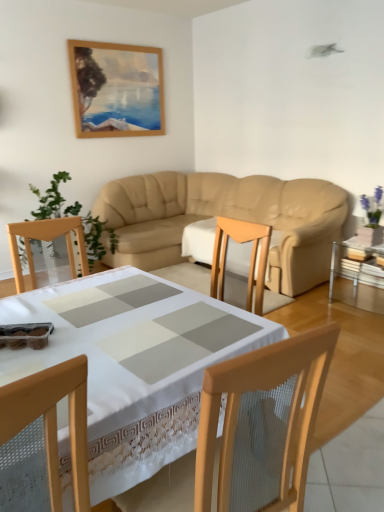
This screenshot has width=384, height=512. Describe the element at coordinates (50, 198) in the screenshot. I see `green leafy plant at left` at that location.

This screenshot has width=384, height=512. What do you see at coordinates (46, 434) in the screenshot?
I see `wooden chair at lower left` at bounding box center [46, 434].

Consider the image. Measure the distance between white lace tablecloth at center, which is the 2th table in back-to-front order, and camera.

The distance of white lace tablecloth at center, which is the 2th table in back-to-front order, from camera is 33.50 inches.

The width and height of the screenshot is (384, 512). I want to click on beige leather couch at center, so click(225, 216).

Which is more to the left, green leafy plant at left or clear glass table at right, placed as the first table when sorted from right to left?

green leafy plant at left.

Is green leafy plant at left situated inside clear glass table at right, placed as the first table when sorted from right to left, or outside?

green leafy plant at left is located beyond the bounds of clear glass table at right, placed as the first table when sorted from right to left.

Are green leafy plant at left and clear glass table at right, which ranks as the second table in front-to-back order, far apart?

Absolutely, green leafy plant at left is distant from clear glass table at right, which ranks as the second table in front-to-back order.

Measure the distance from green leafy plant at left to clear glass table at right, arranged as the 2th table when viewed from the left.

green leafy plant at left and clear glass table at right, arranged as the 2th table when viewed from the left, are 2.50 meters apart from each other.

From a real-world perspective, between white lace tablecloth at center, arranged as the first table when viewed from the front, and beige leather couch at center, who is vertically lower?

In real-world perspective, white lace tablecloth at center, arranged as the first table when viewed from the front, is lower.

Would you say white lace tablecloth at center, which is the 2th table in back-to-front order, is to the left or to the right of beige leather couch at center in the picture?

white lace tablecloth at center, which is the 2th table in back-to-front order, is positioned on beige leather couch at center's left side.

Between point (137, 315) and point (105, 200), which one is positioned in front?

Positioned in front is point (137, 315).

Looking at this image, does clear glass table at right, placed as the first table when sorted from right to left, turn towards white lace tablecloth at center, which is the 2th table in back-to-front order?

Yes, clear glass table at right, placed as the first table when sorted from right to left, is aimed at white lace tablecloth at center, which is the 2th table in back-to-front order.

Is there a large distance between clear glass table at right, placed as the first table when sorted from right to left, and white lace tablecloth at center, which is the 2th table in back-to-front order?

That's right, there is a large distance between clear glass table at right, placed as the first table when sorted from right to left, and white lace tablecloth at center, which is the 2th table in back-to-front order.

From the image's perspective, between clear glass table at right, placed as the first table when sorted from right to left, and white lace tablecloth at center, the 2th table positioned from the right, which one is located above?

clear glass table at right, placed as the first table when sorted from right to left, is shown above in the image.

Looking at this image, considering the relative sizes of clear glass table at right, placed as the first table when sorted from right to left, and white lace tablecloth at center, the 2th table positioned from the right, in the image provided, is clear glass table at right, placed as the first table when sorted from right to left, taller than white lace tablecloth at center, the 2th table positioned from the right,?

No.

From a real-world perspective, is clear glass table at right, which is the first table in back-to-front order, on top of wooden chair at lower left?

No.

From the image's perspective, which one is positioned higher, clear glass table at right, which ranks as the second table in front-to-back order, or wooden chair at lower left?

clear glass table at right, which ranks as the second table in front-to-back order.

Considering their positions, is clear glass table at right, placed as the first table when sorted from right to left, located in front of or behind wooden chair at lower left?

In the image, clear glass table at right, placed as the first table when sorted from right to left, appears behind wooden chair at lower left.

Is beige leather couch at center to the left or to the right of wooden chair at lower left in the image?

Clearly, beige leather couch at center is on the right of wooden chair at lower left in the image.

Considering the sizes of objects beige leather couch at center and wooden chair at lower left in the image provided, who is bigger, beige leather couch at center or wooden chair at lower left?

beige leather couch at center is bigger.

From the picture: Can you tell me how much beige leather couch at center and wooden chair at lower left differ in facing direction?

86.3 degrees.

Is beige leather couch at center turned away from wooden chair at lower left?

No, beige leather couch at center is not facing the opposite direction of wooden chair at lower left.

From the image's perspective, is white lace tablecloth at center, arranged as the first table when viewed from the front, on top of green leafy plant at left?

No, from the image's perspective, white lace tablecloth at center, arranged as the first table when viewed from the front, is not over green leafy plant at left.

Are white lace tablecloth at center, the 2th table positioned from the right, and green leafy plant at left beside each other?

No, white lace tablecloth at center, the 2th table positioned from the right, is not with green leafy plant at left.

Which of these two, white lace tablecloth at center, the 2th table positioned from the right, or green leafy plant at left, is smaller?

white lace tablecloth at center, the 2th table positioned from the right, is smaller.

Considering their positions, is white lace tablecloth at center, which is the 2th table in back-to-front order, located in front of or behind green leafy plant at left?

Clearly, white lace tablecloth at center, which is the 2th table in back-to-front order, is in front of green leafy plant at left.

Which of these two, beige leather couch at center or clear glass table at right, which ranks as the second table in front-to-back order, is wider?

With larger width is beige leather couch at center.

Which is correct: beige leather couch at center is inside clear glass table at right, placed as the first table when sorted from right to left, or outside of it?

beige leather couch at center is not enclosed by clear glass table at right, placed as the first table when sorted from right to left.

Is clear glass table at right, placed as the first table when sorted from right to left, at the back of beige leather couch at center?

No.

Starting from the green leafy plant at left, which table is the 2nd one to the right? Please provide its 2D coordinates.

[(358, 276)]

Find the location of a particular element. The width and height of the screenshot is (384, 512). studio couch that appears above the white lace tablecloth at center, the 2th table positioned from the right (from a real-world perspective) is located at coordinates (225, 216).

Considering their positions, is wooden chair at lower left positioned further to white lace tablecloth at center, the 1th table from the left, than green leafy plant at left?

green leafy plant at left is positioned further to the anchor white lace tablecloth at center, the 1th table from the left.

From the image, which object appears to be nearer to green leafy plant at left, white lace tablecloth at center, which is the 2th table in back-to-front order, or clear glass table at right, which ranks as the second table in front-to-back order?

white lace tablecloth at center, which is the 2th table in back-to-front order, lies closer to green leafy plant at left than the other object.

From the picture: When comparing their distances from clear glass table at right, placed as the first table when sorted from right to left, does white lace tablecloth at center, the 1th table from the left, or wooden chair at lower left seem further?

Based on the image, wooden chair at lower left appears to be further to clear glass table at right, placed as the first table when sorted from right to left.

Based on their spatial positions, is beige leather couch at center or wooden chair at lower left further from green leafy plant at left?

wooden chair at lower left is further to green leafy plant at left.

Based on their spatial positions, is clear glass table at right, arranged as the 2th table when viewed from the left, or beige leather couch at center closer to wooden chair at lower left?

clear glass table at right, arranged as the 2th table when viewed from the left.

Looking at the image, which one is located closer to green leafy plant at left, clear glass table at right, which ranks as the second table in front-to-back order, or wooden chair at lower left?

Among the two, clear glass table at right, which ranks as the second table in front-to-back order, is located nearer to green leafy plant at left.

Looking at the image, which one is located closer to clear glass table at right, placed as the first table when sorted from right to left, wooden chair at lower left or green leafy plant at left?

Based on the image, green leafy plant at left appears to be nearer to clear glass table at right, placed as the first table when sorted from right to left.

From the image, which object appears to be nearer to green leafy plant at left, wooden chair at lower left or beige leather couch at center?

beige leather couch at center.

I want to click on studio couch located between white lace tablecloth at center, the 1th table from the left, and green leafy plant at left in the depth direction, so click(225, 216).

Locate an element on the screen. The width and height of the screenshot is (384, 512). table between wooden chair at lower left and beige leather couch at center from front to back is located at coordinates (136, 365).

The width and height of the screenshot is (384, 512). I want to click on studio couch between white lace tablecloth at center, the 1th table from the left, and clear glass table at right, arranged as the 2th table when viewed from the left, from front to back, so click(225, 216).

Locate an element on the screen. table situated between green leafy plant at left and clear glass table at right, which ranks as the second table in front-to-back order, from left to right is located at coordinates (136, 365).